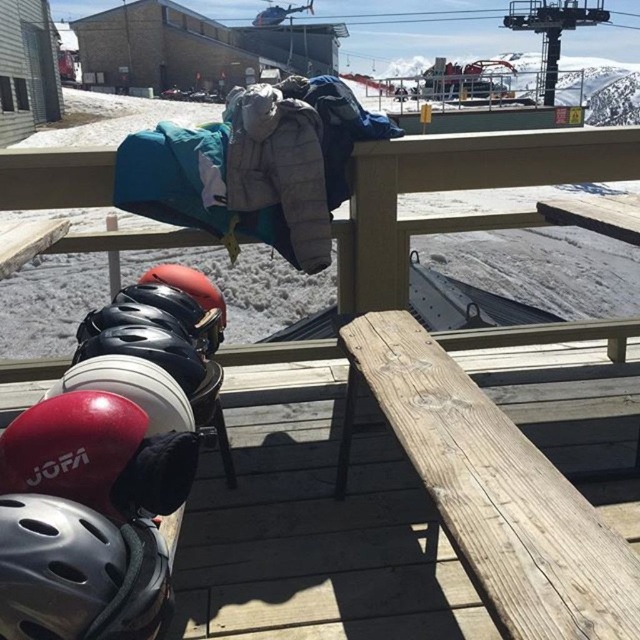
Question: Among these objects, which one is farthest from the camera?

Choices:
 (A) shiny red helmet at lower left
 (B) shiny black helmet at left

Answer: (B)

Question: From the image, what is the correct spatial relationship of shiny red helmet at lower left in relation to shiny black helmet at left?

Choices:
 (A) left
 (B) right

Answer: (B)

Question: Estimate the real-world distances between objects in this image. Which object is farther from the matte black helmet at lower left?

Choices:
 (A) shiny red helmet at lower left
 (B) shiny black helmet at left

Answer: (B)

Question: Is matte black helmet at lower left below shiny red helmet at lower left?

Choices:
 (A) no
 (B) yes

Answer: (B)

Question: Is matte black helmet at lower left bigger than shiny black helmet at left?

Choices:
 (A) yes
 (B) no

Answer: (B)

Question: Estimate the real-world distances between objects in this image. Which object is farther from the shiny red helmet at lower left?

Choices:
 (A) shiny black helmet at left
 (B) matte black helmet at lower left

Answer: (A)